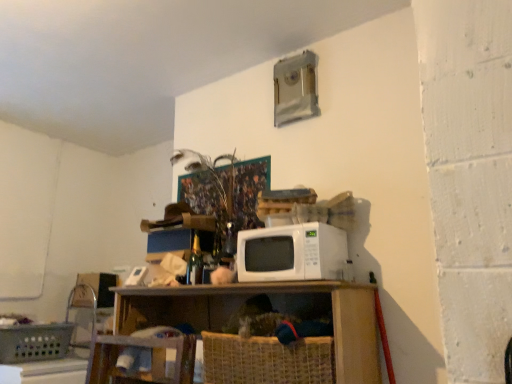
Question: Does wooden shelf at center contain wooden swivel chair at lower left?

Choices:
 (A) no
 (B) yes

Answer: (B)

Question: Considering the relative sizes of wooden shelf at center and wooden swivel chair at lower left in the image provided, is wooden shelf at center shorter than wooden swivel chair at lower left?

Choices:
 (A) no
 (B) yes

Answer: (A)

Question: From the image's perspective, is wooden shelf at center on wooden swivel chair at lower left?

Choices:
 (A) yes
 (B) no

Answer: (A)

Question: Does wooden shelf at center come in front of wooden swivel chair at lower left?

Choices:
 (A) yes
 (B) no

Answer: (A)

Question: Can you confirm if wooden shelf at center is bigger than wooden swivel chair at lower left?

Choices:
 (A) yes
 (B) no

Answer: (A)

Question: Considering the relative sizes of wooden shelf at center and wooden swivel chair at lower left in the image provided, is wooden shelf at center wider than wooden swivel chair at lower left?

Choices:
 (A) yes
 (B) no

Answer: (A)

Question: From a real-world perspective, is wooden shelf at center under white matte microwave at center?

Choices:
 (A) no
 (B) yes

Answer: (B)

Question: From the image's perspective, would you say wooden shelf at center is shown under white matte microwave at center?

Choices:
 (A) no
 (B) yes

Answer: (B)

Question: Can you confirm if wooden shelf at center is positioned to the left of white matte microwave at center?

Choices:
 (A) no
 (B) yes

Answer: (B)

Question: From the image's perspective, is wooden shelf at center on white matte microwave at center?

Choices:
 (A) yes
 (B) no

Answer: (B)

Question: Is wooden shelf at center wider than white matte microwave at center?

Choices:
 (A) no
 (B) yes

Answer: (B)

Question: Is wooden shelf at center oriented towards white matte microwave at center?

Choices:
 (A) yes
 (B) no

Answer: (B)

Question: From a real-world perspective, is plastic woven basket at lower left, the first basket viewed from the back, located higher than wooden shelf at center?

Choices:
 (A) no
 (B) yes

Answer: (A)